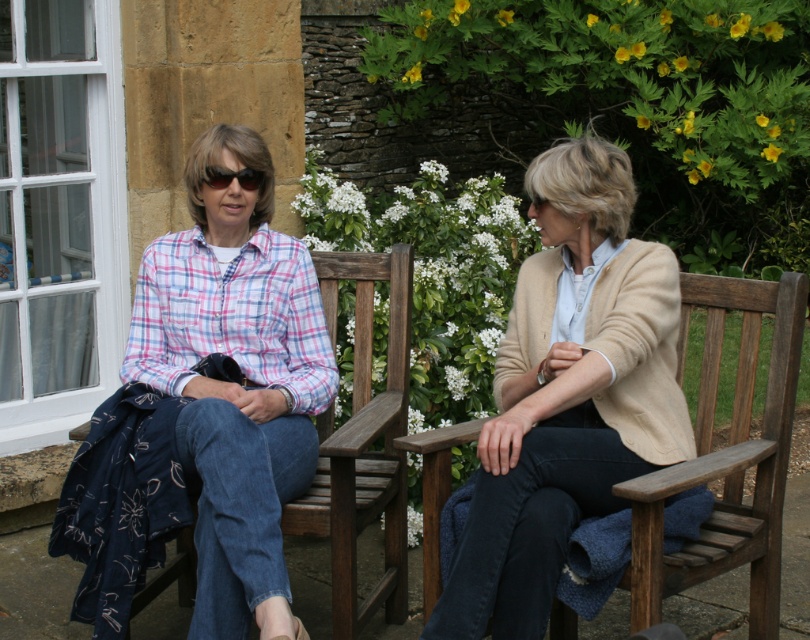
Question: Among these points, which one is nearest to the camera?

Choices:
 (A) (448, 586)
 (B) (352, 396)
 (C) (239, 172)

Answer: (A)

Question: Which of the following is the farthest from the observer?

Choices:
 (A) wooden bench at left
 (B) beige wool cardigan at center
 (C) black plastic sunglasses at upper left

Answer: (C)

Question: Can you confirm if wooden bench at left is positioned to the left of black plastic sunglasses at upper left?

Choices:
 (A) yes
 (B) no

Answer: (B)

Question: Can you confirm if beige wool cardigan at center is positioned to the left of wooden bench at left?

Choices:
 (A) no
 (B) yes

Answer: (A)

Question: Which point appears farthest from the camera in this image?

Choices:
 (A) (344, 513)
 (B) (214, 186)
 (C) (510, 364)

Answer: (B)

Question: Can you confirm if beige wool cardigan at center is thinner than black plastic sunglasses at upper left?

Choices:
 (A) no
 (B) yes

Answer: (A)